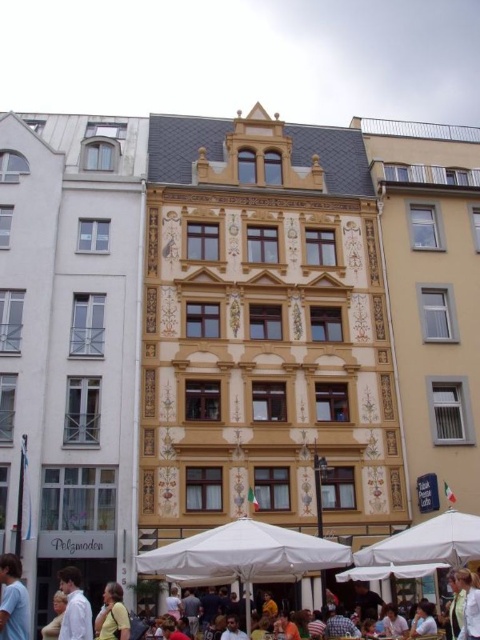
You are a pedestrian standing in the urban scene described. You notice both the white fabric umbrella at lower center and the yellow shirt at lower center. Which object is shorter in height?

The white fabric umbrella at lower center is shorter in height compared to the yellow shirt at lower center.